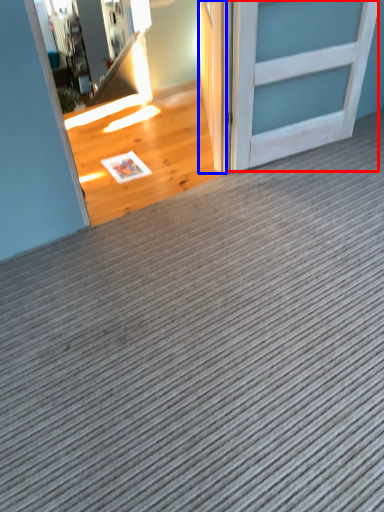
Question: Which of the following is the farthest to the observer, door (highlighted by a red box) or door (highlighted by a blue box)?

Choices:
 (A) door
 (B) door

Answer: (B)